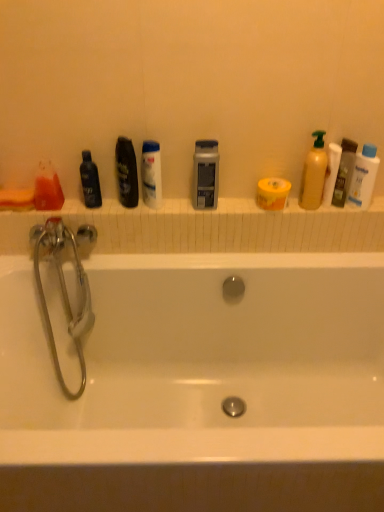
Question: Considering the relative sizes of matte yellow bottle at right, the first cleaning product viewed from the left, and translucent plastic mouthwash at right, acting as the 6th mouthwash starting from the left, in the image provided, is matte yellow bottle at right, the first cleaning product viewed from the left, taller than translucent plastic mouthwash at right, acting as the 6th mouthwash starting from the left,?

Choices:
 (A) no
 (B) yes

Answer: (B)

Question: From a real-world perspective, is matte yellow bottle at right, acting as the 2th cleaning product starting from the right, over translucent plastic mouthwash at right, the first mouthwash in the right-to-left sequence?

Choices:
 (A) yes
 (B) no

Answer: (A)

Question: Is matte yellow bottle at right, the first cleaning product viewed from the left, to the left of translucent plastic mouthwash at right, the first mouthwash in the right-to-left sequence, from the viewer's perspective?

Choices:
 (A) no
 (B) yes

Answer: (B)

Question: Is matte yellow bottle at right, acting as the 2th cleaning product starting from the right, with translucent plastic mouthwash at right, the first mouthwash in the right-to-left sequence?

Choices:
 (A) yes
 (B) no

Answer: (A)

Question: Is matte yellow bottle at right, acting as the 2th cleaning product starting from the right, in front of translucent plastic mouthwash at right, the first mouthwash in the right-to-left sequence?

Choices:
 (A) no
 (B) yes

Answer: (B)

Question: From the image's perspective, is matte yellow bottle at right, acting as the 2th cleaning product starting from the right, under translucent plastic mouthwash at right, the first mouthwash in the right-to-left sequence?

Choices:
 (A) yes
 (B) no

Answer: (B)

Question: Is white plastic baby lotion at upper right, acting as the second cleaning product starting from the left, surrounding black glossy mouthwash at left, which is counted as the second mouthwash, starting from the left?

Choices:
 (A) yes
 (B) no

Answer: (B)

Question: From a real-world perspective, is white plastic baby lotion at upper right, the first cleaning product when ordered from right to left, on top of black glossy mouthwash at left, which appears as the fifth mouthwash when viewed from the right?

Choices:
 (A) no
 (B) yes

Answer: (B)

Question: Is white plastic baby lotion at upper right, acting as the second cleaning product starting from the left, positioned before black glossy mouthwash at left, which appears as the fifth mouthwash when viewed from the right?

Choices:
 (A) yes
 (B) no

Answer: (A)

Question: Considering the relative sizes of white plastic baby lotion at upper right, acting as the second cleaning product starting from the left, and black glossy mouthwash at left, which is counted as the second mouthwash, starting from the left, in the image provided, is white plastic baby lotion at upper right, acting as the second cleaning product starting from the left, wider than black glossy mouthwash at left, which is counted as the second mouthwash, starting from the left,?

Choices:
 (A) yes
 (B) no

Answer: (A)

Question: Could you tell me if white plastic baby lotion at upper right, the first cleaning product when ordered from right to left, is turned towards black glossy mouthwash at left, which appears as the fifth mouthwash when viewed from the right?

Choices:
 (A) no
 (B) yes

Answer: (A)

Question: From a real-world perspective, is white plastic baby lotion at upper right, the first cleaning product when ordered from right to left, beneath black glossy mouthwash at left, which appears as the fifth mouthwash when viewed from the right?

Choices:
 (A) yes
 (B) no

Answer: (B)

Question: From the image's perspective, is white plastic baby lotion at upper right, acting as the second cleaning product starting from the left, located above translucent orange liquid at left, arranged as the first mouthwash when viewed from the left?

Choices:
 (A) yes
 (B) no

Answer: (A)